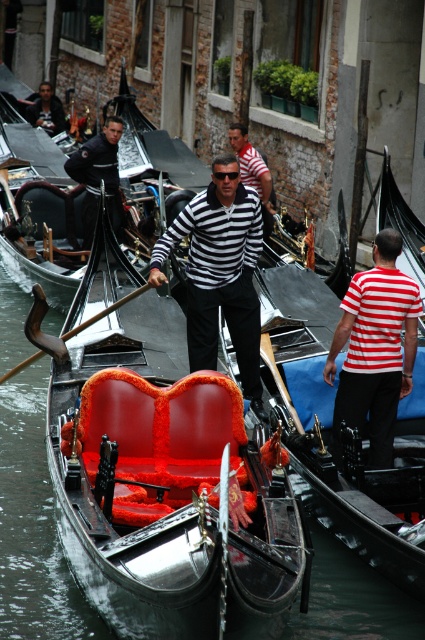
You are a tourist standing on the bridge overlooking the canal. You notice the velvet red seat at center and the striped fabric shirt at center. Which object is positioned lower in the scene?

The velvet red seat at center is located below striped fabric shirt at center, so the velvet red seat at center is positioned lower in the scene.

What is the object located at the coordinates point (220, 273) in the image?

The object located at point (220, 273) is the striped fabric shirt at center.

What is located at the coordinates point (159,472) in the image?

The velvet red seat at center is located at point (159,472).